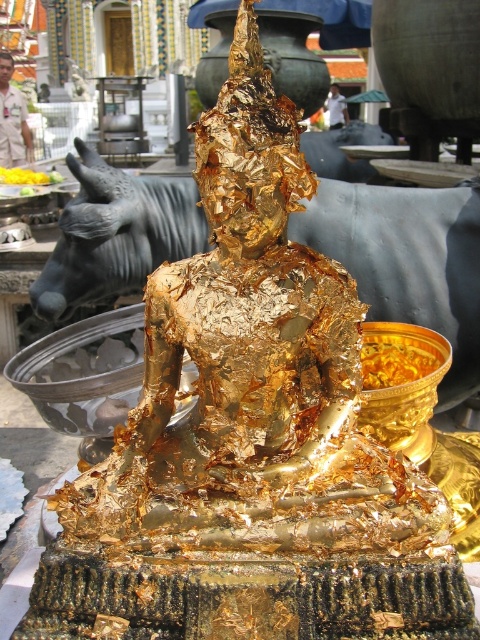
You are an art student observing the golden Buddha statue and the black polished stone bull at center. You notice both are at the center, but the description says the black polished stone bull is to the right of the gold flake food at center. Can you explain their positions relative to each other?

The black polished stone bull at center is positioned to the right of the gold flake food at center, meaning the gold flake food is on the left side relative to the bull.

You are a tourist visiting this sacred site and notice a small item at the center of the image. What is the exact location of the gold flake food at center in terms of coordinates?

The gold flake food at center is located at coordinates point (396, 358).

You are a visitor at a temple and see the gold flake food at center and the black polished stone bull at center. Which object is closer to you?

The black polished stone bull at center is closer to you because the gold flake food at center is behind it.